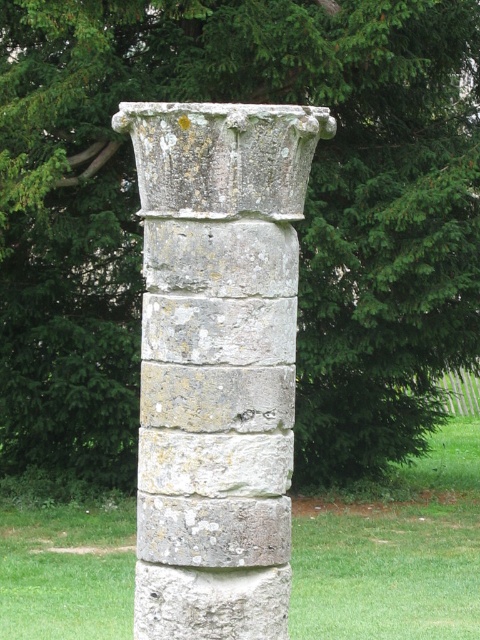
You are a landscape architect designing a garden path. You need to place a decorative stone column in the center of the path. The path is currently 2 meters wide. Based on the image, will the weathered stone column at center fit within the path without encroaching on the green grass at center?

The weathered stone column at center has a width less than the green grass at center, so it will fit within the 2 meter path without encroaching on the green grass at center.

You are designing a garden layout and need to know the spatial relationship between the weathered stone column at center and the green grass at center. Which one takes up more area in the image?

The green grass at center occupies more space than the weathered stone column at center, as stated in the description.

You are a gardener looking to plant a new flower bed around the weathered stone column at center. Since the green grass at center is already present, where should you place the flowers in relation to the column?

The weathered stone column at center is above the green grass at center, so you should place the flowers on the ground around the base of the column where the grass is located.